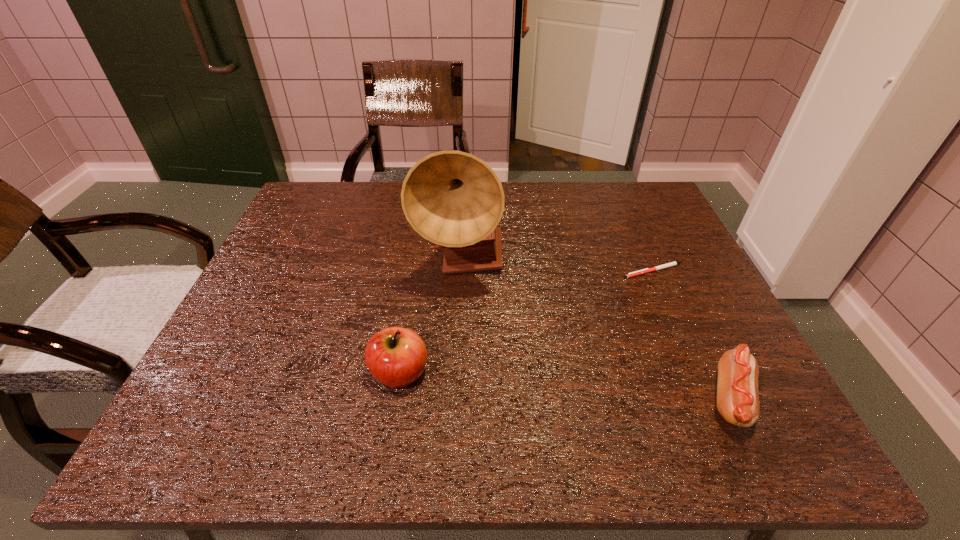
You are a GUI agent. You are given a task and a screenshot of the screen. Output one action in this format:
    pyautogui.click(x=<x>, y=<y>)
    Task: Click on the free region located 0.140m on the horn of the phonograph record
    The height and width of the screenshot is (540, 960).
    Given the screenshot: What is the action you would take?
    pyautogui.click(x=511, y=334)

Where is `vacant area located 0.230m on the horn of the phonograph record`? This screenshot has height=540, width=960. vacant area located 0.230m on the horn of the phonograph record is located at coordinates (534, 363).

Locate an element on the screen. The image size is (960, 540). apple at the near edge is located at coordinates (396, 357).

Identify the location of sausage that is at the near edge. (737, 387).

This screenshot has width=960, height=540. In order to click on sausage at the right edge in this screenshot , I will do `click(737, 387)`.

In order to click on pen positioned at the right edge in this screenshot , I will do `click(643, 271)`.

Where is `object that is positioned at the near right corner`? This screenshot has height=540, width=960. object that is positioned at the near right corner is located at coordinates (737, 387).

Where is `blank area at the far edge`? blank area at the far edge is located at coordinates (569, 205).

At what (x,y) coordinates should I click in order to perform the action: click on vacant area at the near edge of the desktop. Please return your answer as a coordinate pair (x, y). The height and width of the screenshot is (540, 960). Looking at the image, I should click on (643, 397).

Image resolution: width=960 pixels, height=540 pixels. Find the location of `vacant area at the right edge`. vacant area at the right edge is located at coordinates (685, 353).